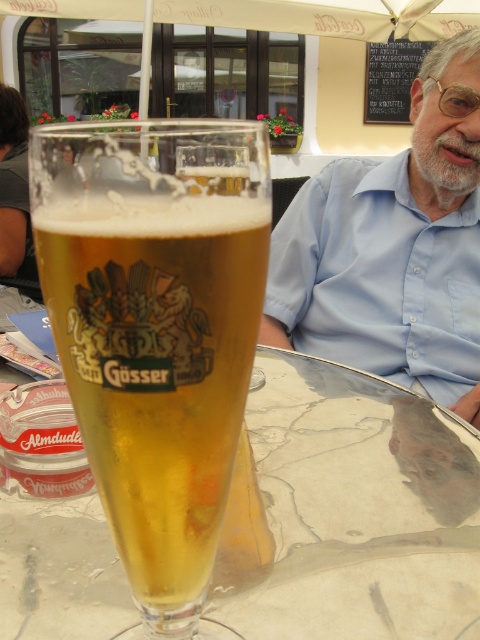
Who is more distant from viewer, [110,280] or [84,611]?

The point [84,611] is more distant.

Does translucent glass beer at center have a lesser height compared to transparent glass table at center?

In fact, translucent glass beer at center may be taller than transparent glass table at center.

This screenshot has height=640, width=480. What do you see at coordinates (158, 333) in the screenshot? I see `translucent glass beer at center` at bounding box center [158, 333].

Identify the location of translucent glass beer at center. (158, 333).

Is translucent glass beer at center shorter than blue cotton shirt at upper center?

Yes, translucent glass beer at center is shorter than blue cotton shirt at upper center.

Which is above, translucent glass beer at center or blue cotton shirt at upper center?

Positioned higher is blue cotton shirt at upper center.

Does point (215, 276) come closer to viewer compared to point (432, 289)?

Yes, point (215, 276) is in front of point (432, 289).

I want to click on translucent glass beer at center, so click(158, 333).

Who is more distant from viewer, (228,598) or (416,163)?

Point (416,163)

Who is positioned more to the left, transparent glass table at center or blue cotton shirt at upper center?

transparent glass table at center

This screenshot has height=640, width=480. What do you see at coordinates (357, 509) in the screenshot?
I see `transparent glass table at center` at bounding box center [357, 509].

Locate an element on the screen. The width and height of the screenshot is (480, 640). transparent glass table at center is located at coordinates (357, 509).